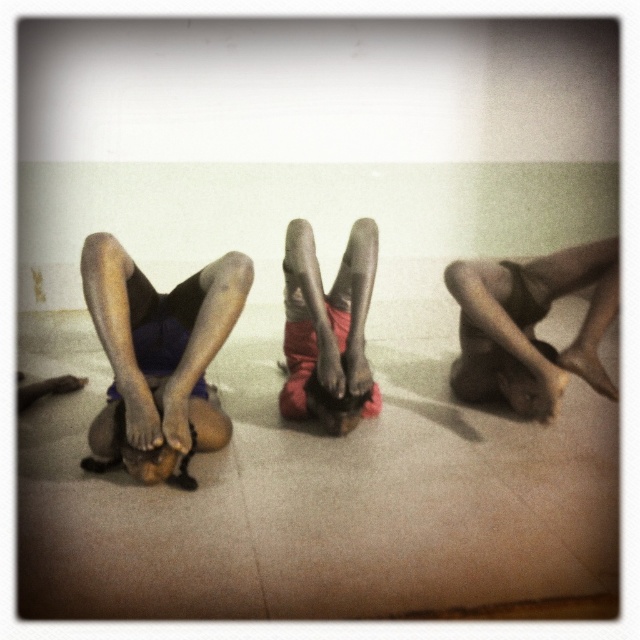
Question: Which of the following is the farthest from the observer?

Choices:
 (A) dark skin legs at center
 (B) smooth skin legs at center

Answer: (B)

Question: From the image, what is the correct spatial relationship of dark skin legs at center in relation to smooth skin legs at center?

Choices:
 (A) above
 (B) below

Answer: (B)

Question: Which point is closer to the camera taking this photo?

Choices:
 (A) (566, 250)
 (B) (186, 330)

Answer: (B)

Question: Is dark skin legs at center thinner than smooth skin legs at center?

Choices:
 (A) yes
 (B) no

Answer: (A)

Question: Does dark skin legs at center appear on the right side of smooth skin legs at center?

Choices:
 (A) no
 (B) yes

Answer: (A)